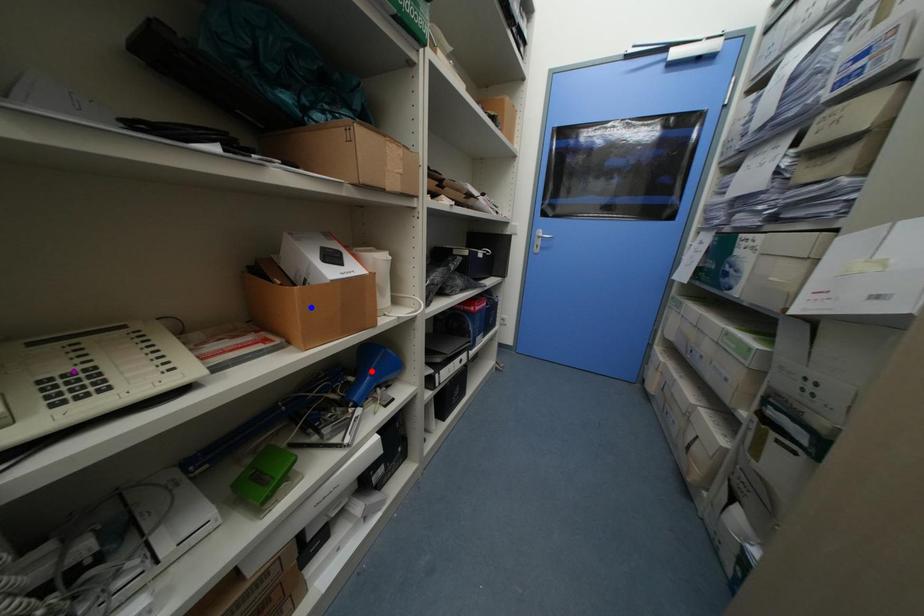
Order these from nearest to farthest:
blue point
purple point
red point

purple point
blue point
red point